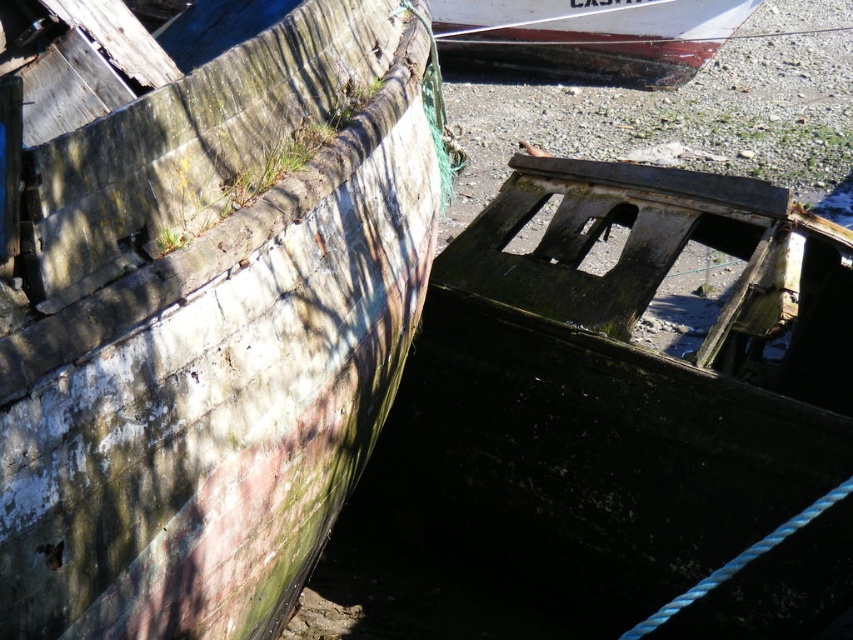
You are a marine biologist assessing the stability of the boats in the image. Given that the dark green weathered wood boat at lower right is narrower than the white painted wood boat at upper center, which boat would you recommend for transporting a heavy equipment crate that requires a wider base for stability?

The white painted wood boat at upper center has a greater width, making it more suitable for transporting the heavy equipment crate due to its wider base providing better stability.

You are a marine biologist examining the two boats in the image. You need to collect samples from the weathered wood boat at left and the other boat. Which boat is closer to the point marked at coordinates (200,298)?

The weathered wood boat at left is closer to the point marked at coordinates (200,298) because the point lies within its location according to the description.